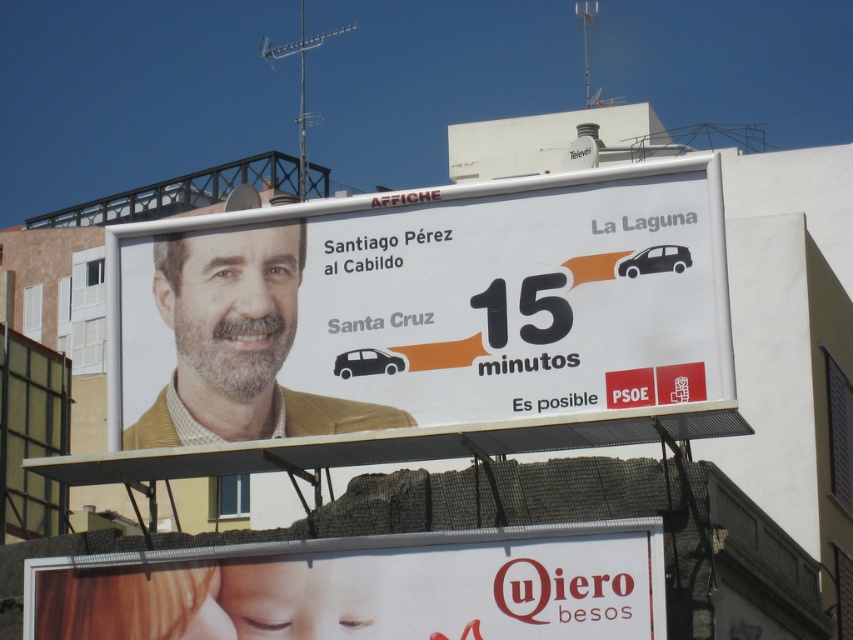
Question: Which of these objects is positioned closest to the white paper billboard at center?

Choices:
 (A) white paper at lower center
 (B) matte yellow jacket at center

Answer: (B)

Question: Which point appears farthest from the camera in this image?

Choices:
 (A) (636, 392)
 (B) (177, 332)
 (C) (633, 518)

Answer: (B)

Question: Which object appears closest to the camera in this image?

Choices:
 (A) white paper at lower center
 (B) white paper billboard at center

Answer: (A)

Question: Does white paper billboard at center lie in front of matte yellow jacket at center?

Choices:
 (A) yes
 (B) no

Answer: (A)

Question: Is white paper at lower center above matte yellow jacket at center?

Choices:
 (A) yes
 (B) no

Answer: (B)

Question: Can you confirm if white paper billboard at center is positioned to the right of matte yellow jacket at center?

Choices:
 (A) yes
 (B) no

Answer: (A)